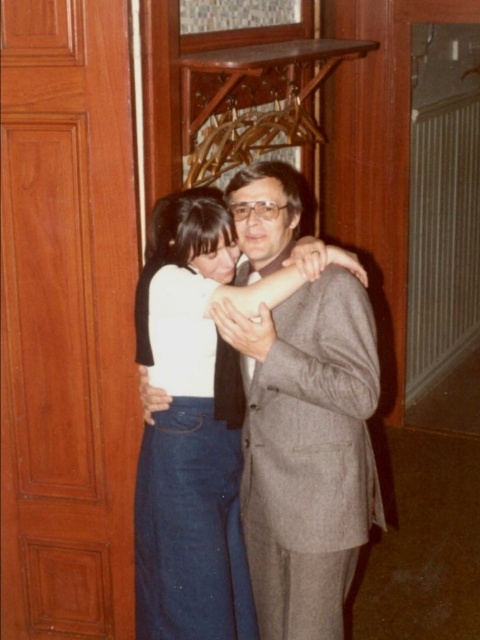
You are a photographer setting up for a photoshoot in a hallway with a wooden door frame and a carved wooden shelf in the background. You need to position two models wearing the matte gray suit at center and the white matte dress at center so that the suit is to the right of the dress. Based on the scene description, are the models currently positioned correctly for the shoot?

Yes, the models are positioned correctly because the matte gray suit at center is already to the right of the white matte dress at center as required.

You are standing in the hallway and want to take a photo of the point at coordinates point (268,602). The camera you are using has a focal length of 50mm and a sensor size of 36mm. If the point is 7.37 feet away from the camera, what is the minimum distance you need to move the camera forward so that the point fills the entire sensor vertically?

The point at coordinates point (268,602) is 7.37 feet from the camera. To calculate the minimum distance needed to move the camera forward so the point fills the sensor vertically, use the formula for magnification. The sensor size is 36mm, and the focal length is 50mm. The required distance would be approximately 0.24 feet closer.